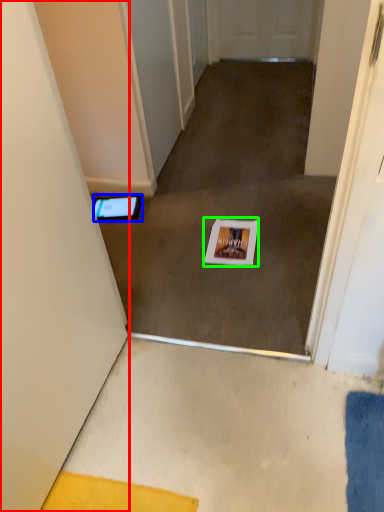
Question: Based on their relative distances, which object is farther from door (highlighted by a red box)? Choose from tablet computer (highlighted by a blue box) and postcard (highlighted by a green box).

Choices:
 (A) tablet computer
 (B) postcard

Answer: (A)